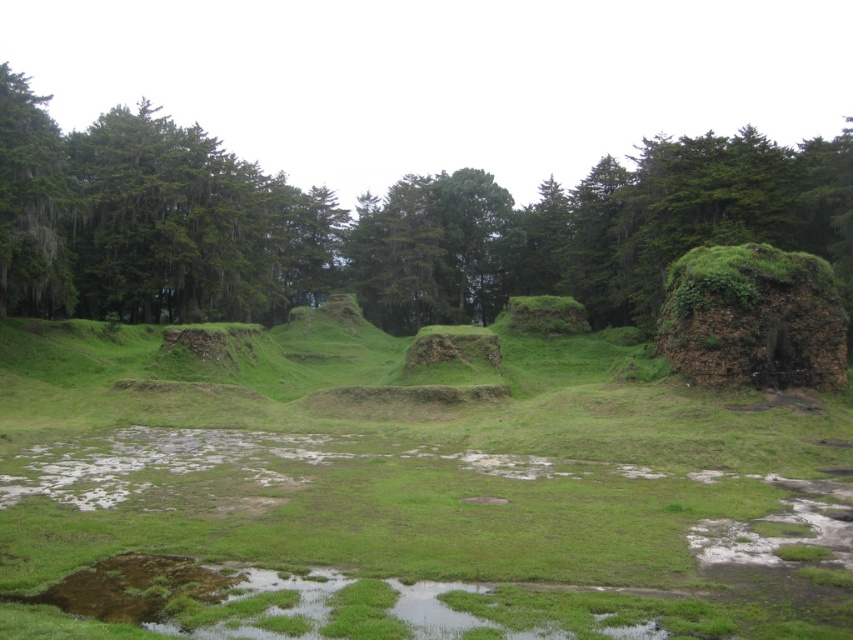
You are a hiker trying to navigate through the grassy field with muddy patches. You see the green leafy tree at center and the green mossy rock at right. Which object would block your path more if you were to walk straight towards the background?

The green leafy tree at center is larger in size than the green mossy rock at right, so it would block your path more when walking straight towards the background.

You are a hiker navigating through the grassy field with muddy patches. You see the green leafy tree at center and the green mossy rock at right. Which object is higher in elevation?

The green leafy tree at center is located above the green mossy rock at right, so it has a higher elevation.

You are a hiker trying to navigate through the grassy field with muddy patches. You notice the green leafy tree at center and the green mossy tree at left. Which tree should you avoid walking near if you want to stay on firmer ground?

You should avoid walking near the green mossy tree at left because the green leafy tree at center is larger, which typically indicates deeper root systems and more stable ground. However, the presence of moss might suggest the area around the green mossy tree at left is wetter and less firm.